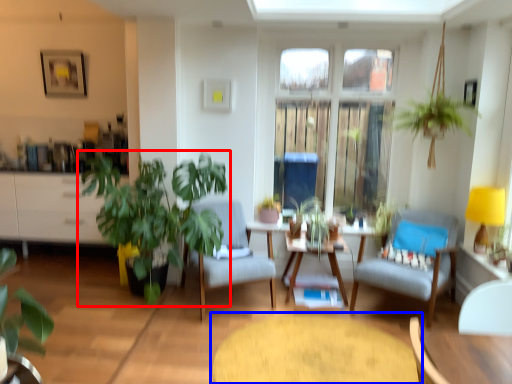
Question: Which object is further to the camera taking this photo, houseplant (highlighted by a red box) or coffee table (highlighted by a blue box)?

Choices:
 (A) houseplant
 (B) coffee table

Answer: (A)